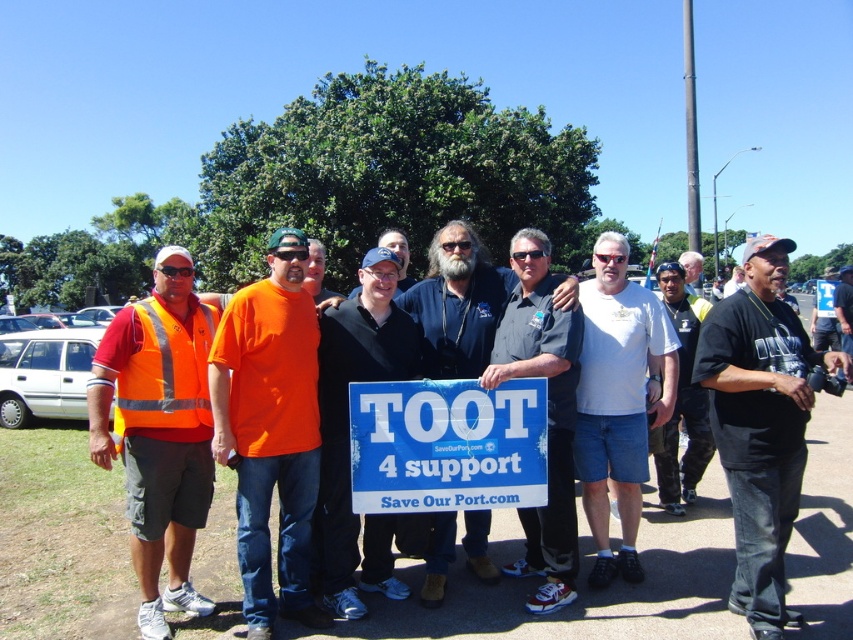
Question: Among these points, which one is farthest from the camera?

Choices:
 (A) (759, 396)
 (B) (125, 422)
 (C) (554, 403)
 (D) (688, 276)

Answer: (D)

Question: Is high-visibility orange safety vest at left positioned in front of blue paper sign at center?

Choices:
 (A) yes
 (B) no

Answer: (A)

Question: Which point is farther from the camera taking this photo?

Choices:
 (A) (544, 314)
 (B) (439, 337)
 (C) (277, 301)

Answer: (B)

Question: Does dark blue jeans at center have a greater width compared to orange safety vest at center?

Choices:
 (A) yes
 (B) no

Answer: (B)

Question: Considering the real-world distances, which object is farthest from the orange safety vest at center?

Choices:
 (A) black cotton t-shirt at center
 (B) dark blue shirt at center
 (C) blue paper sign at center

Answer: (A)

Question: Is black cotton t-shirt at center closer to the viewer compared to blue paper sign at center?

Choices:
 (A) yes
 (B) no

Answer: (A)